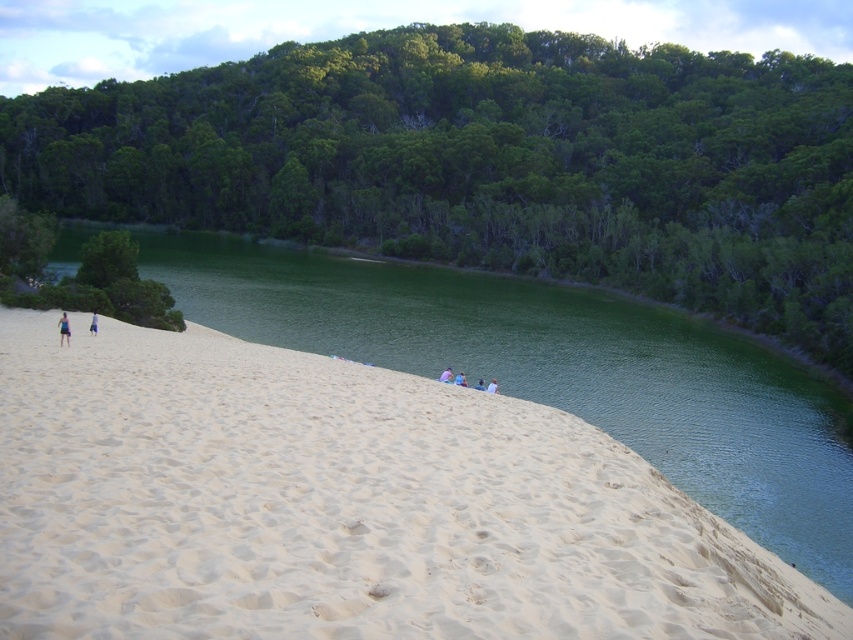
Question: Can you confirm if beige sandy hill at lower left is smaller than light blue fabric at lower left?

Choices:
 (A) yes
 (B) no

Answer: (B)

Question: Which of these objects is positioned closest to the light brown fabric shirt at center?

Choices:
 (A) light blue fabric at lower left
 (B) pink fabric person at center
 (C) light blue fabric at left

Answer: (B)

Question: Which of the following is the farthest from the observer?

Choices:
 (A) (91, 328)
 (B) (483, 381)
 (C) (462, 378)

Answer: (A)

Question: Is the position of light blue fabric at lower left more distant than that of white fabric person at lower center?

Choices:
 (A) no
 (B) yes

Answer: (A)

Question: Estimate the real-world distances between objects in this image. Which object is closer to the white fabric person at lower center?

Choices:
 (A) beige sandy hill at lower left
 (B) light brown fabric shirt at center

Answer: (B)

Question: Is pink fabric person at center positioned behind white fabric person at lower center?

Choices:
 (A) no
 (B) yes

Answer: (B)